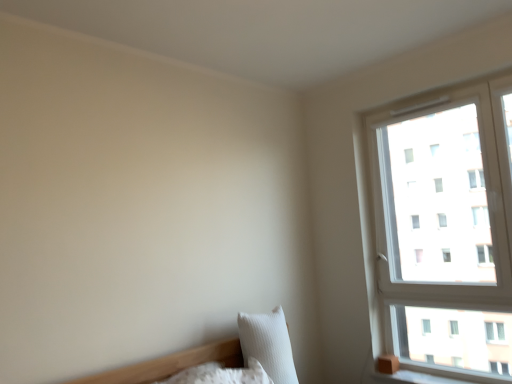
Question: Considering the relative positions of white plastic window at upper right and white soft pillow at lower left, which is the 2th pillow in right-to-left order, in the image provided, is white plastic window at upper right to the right of white soft pillow at lower left, which is the 2th pillow in right-to-left order, from the viewer's perspective?

Choices:
 (A) yes
 (B) no

Answer: (A)

Question: Is white plastic window at upper right taller than white soft pillow at lower left, which is the 2th pillow in right-to-left order?

Choices:
 (A) yes
 (B) no

Answer: (A)

Question: Is white plastic window at upper right facing towards white soft pillow at lower left, which is the 2th pillow in right-to-left order?

Choices:
 (A) no
 (B) yes

Answer: (B)

Question: From a real-world perspective, is white plastic window at upper right positioned under white soft pillow at lower left, which is the 2th pillow in right-to-left order, based on gravity?

Choices:
 (A) yes
 (B) no

Answer: (B)

Question: From the image's perspective, is white plastic window at upper right beneath white soft pillow at lower left, which is the 2th pillow in right-to-left order?

Choices:
 (A) no
 (B) yes

Answer: (A)

Question: Would you say white plastic window at upper right is a long distance from white soft pillow at lower left, which is the 2th pillow in right-to-left order?

Choices:
 (A) yes
 (B) no

Answer: (A)

Question: From the image's perspective, is white plastic window at upper right located beneath white textured pillow at lower right, arranged as the 1th pillow when viewed from the right?

Choices:
 (A) no
 (B) yes

Answer: (A)

Question: Is the depth of white plastic window at upper right greater than that of white textured pillow at lower right, positioned as the second pillow in left-to-right order?

Choices:
 (A) no
 (B) yes

Answer: (A)

Question: Can you confirm if white plastic window at upper right is thinner than white textured pillow at lower right, arranged as the 1th pillow when viewed from the right?

Choices:
 (A) no
 (B) yes

Answer: (B)

Question: Considering the relative positions of white plastic window at upper right and white textured pillow at lower right, positioned as the second pillow in left-to-right order, in the image provided, is white plastic window at upper right to the right of white textured pillow at lower right, positioned as the second pillow in left-to-right order, from the viewer's perspective?

Choices:
 (A) yes
 (B) no

Answer: (A)

Question: Can you confirm if white plastic window at upper right is wider than white textured pillow at lower right, arranged as the 1th pillow when viewed from the right?

Choices:
 (A) no
 (B) yes

Answer: (A)

Question: Is white plastic window at upper right not within white textured pillow at lower right, positioned as the second pillow in left-to-right order?

Choices:
 (A) no
 (B) yes

Answer: (B)

Question: From a real-world perspective, is white textured pillow at lower right, positioned as the second pillow in left-to-right order, physically below white plastic window at upper right?

Choices:
 (A) yes
 (B) no

Answer: (A)